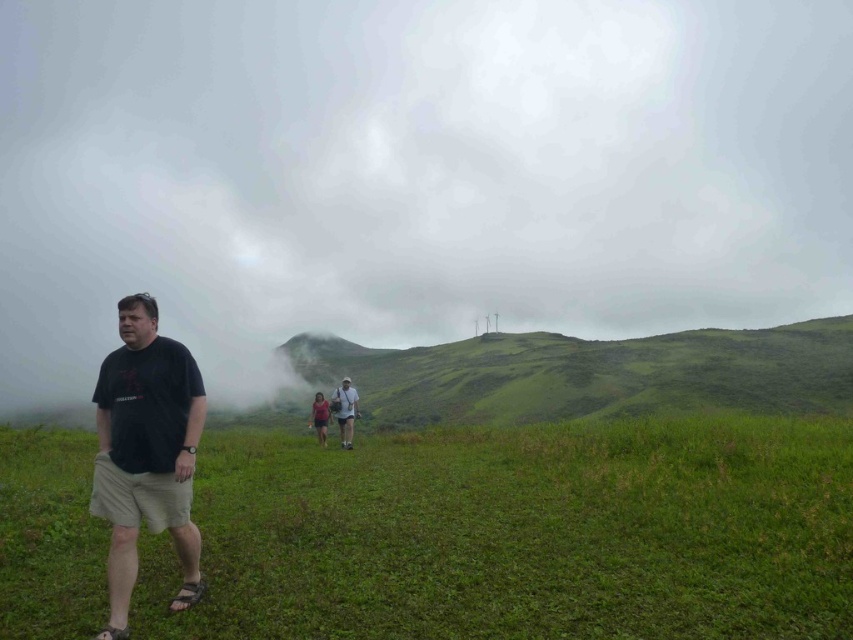
Is light brown shorts at center thinner than pink fabric at center?

Yes, light brown shorts at center is thinner than pink fabric at center.

Which is below, light brown shorts at center or pink fabric at center?

pink fabric at center is below.

What do you see at coordinates (345, 410) in the screenshot?
I see `light brown shorts at center` at bounding box center [345, 410].

At what (x,y) coordinates should I click in order to perform the action: click on light brown shorts at center. Please return your answer as a coordinate pair (x, y). Looking at the image, I should click on (345, 410).

Is green grassy hillside at center wider than pink fabric at center?

Indeed, green grassy hillside at center has a greater width compared to pink fabric at center.

Which is above, green grassy hillside at center or pink fabric at center?

green grassy hillside at center is higher up.

Which is behind, point (466, 346) or point (326, 420)?

The point (466, 346) is more distant.

At what (x,y) coordinates should I click in order to perform the action: click on green grassy hillside at center. Please return your answer as a coordinate pair (x, y). Looking at the image, I should click on (590, 372).

Can you confirm if black cotton shirt at left is smaller than pink fabric at center?

Yes.

Can you confirm if black cotton shirt at left is positioned to the right of pink fabric at center?

Correct, you'll find black cotton shirt at left to the right of pink fabric at center.

Which is behind, point (158, 524) or point (312, 419)?

Positioned behind is point (312, 419).

This screenshot has width=853, height=640. What are the coordinates of `black cotton shirt at left` in the screenshot? It's located at (146, 452).